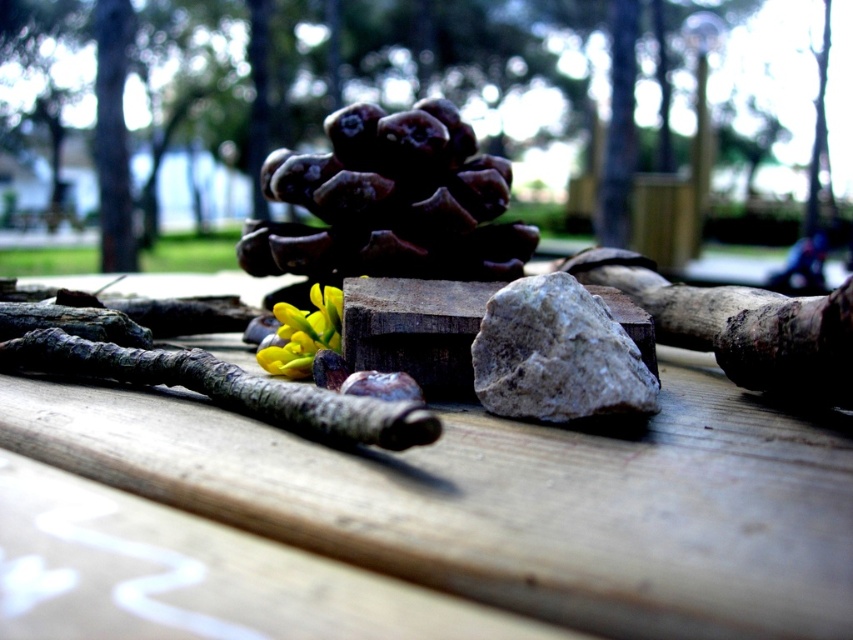
Between gray rough rock at center and brown rough log at center, which one has less height?

brown rough log at center

Does gray rough rock at center appear on the right side of brown rough log at center?

Correct, you'll find gray rough rock at center to the right of brown rough log at center.

Is point (527, 390) in front of point (100, 348)?

Yes, it is.

You are a GUI agent. You are given a task and a screenshot of the screen. Output one action in this format:
    pyautogui.click(x=<x>, y=<y>)
    Task: Click on the gray rough rock at center
    
    Given the screenshot: What is the action you would take?
    pyautogui.click(x=556, y=355)

Is wooden table at center above brown rough log at center?

Correct, wooden table at center is located above brown rough log at center.

Who is positioned more to the left, wooden table at center or brown rough log at center?

Positioned to the left is brown rough log at center.

This screenshot has width=853, height=640. Find the location of `wooden table at center`. wooden table at center is located at coordinates tap(514, 500).

Is the position of wooden table at center more distant than that of gray rough rock at center?

No, wooden table at center is in front of gray rough rock at center.

Who is positioned more to the left, wooden table at center or gray rough rock at center?

Positioned to the left is wooden table at center.

Does point (569, 582) lie in front of point (474, 387)?

Yes.

Identify the location of wooden table at center. The height and width of the screenshot is (640, 853). (514, 500).